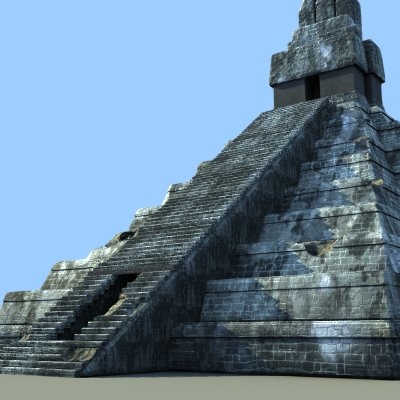
The image size is (400, 400). I want to click on entrance, so click(x=89, y=302).